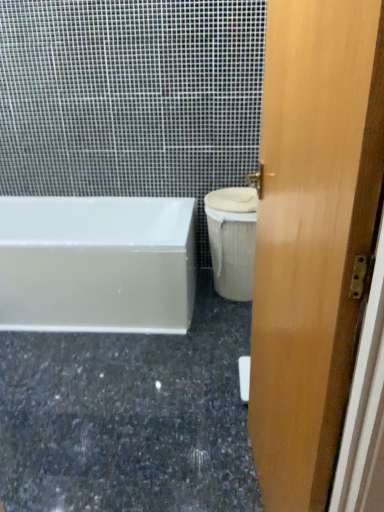
Question: From a real-world perspective, is light brown wood door at right located beneath granite at lower left?

Choices:
 (A) yes
 (B) no

Answer: (B)

Question: Can you confirm if light brown wood door at right is bigger than granite at lower left?

Choices:
 (A) no
 (B) yes

Answer: (B)

Question: From the image's perspective, is light brown wood door at right above granite at lower left?

Choices:
 (A) yes
 (B) no

Answer: (A)

Question: Can you confirm if light brown wood door at right is shorter than granite at lower left?

Choices:
 (A) yes
 (B) no

Answer: (B)

Question: Is light brown wood door at right not inside granite at lower left?

Choices:
 (A) yes
 (B) no

Answer: (A)

Question: Considering the relative positions of light brown wood door at right and granite at lower left in the image provided, is light brown wood door at right behind granite at lower left?

Choices:
 (A) no
 (B) yes

Answer: (A)

Question: Would you say white glossy bathtub at left contains light brown wood door at right?

Choices:
 (A) no
 (B) yes

Answer: (A)

Question: Is white glossy bathtub at left thinner than light brown wood door at right?

Choices:
 (A) no
 (B) yes

Answer: (A)

Question: Is white glossy bathtub at left positioned with its back to light brown wood door at right?

Choices:
 (A) no
 (B) yes

Answer: (A)

Question: Does white glossy bathtub at left have a larger size compared to light brown wood door at right?

Choices:
 (A) no
 (B) yes

Answer: (B)

Question: Does white glossy bathtub at left have a greater height compared to light brown wood door at right?

Choices:
 (A) yes
 (B) no

Answer: (B)

Question: Considering the relative positions of white glossy bathtub at left and light brown wood door at right in the image provided, is white glossy bathtub at left to the left of light brown wood door at right from the viewer's perspective?

Choices:
 (A) yes
 (B) no

Answer: (A)

Question: Is white fabric-covered toilet bowl at right behind light brown wood door at right?

Choices:
 (A) no
 (B) yes

Answer: (B)